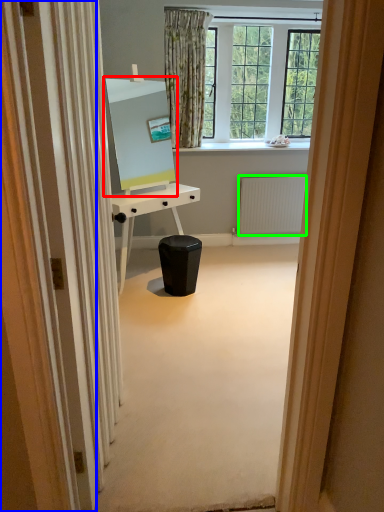
Question: Estimate the real-world distances between objects in this image. Which object is farther from computer monitor (highlighted by a red box), screen door (highlighted by a blue box) or radiator (highlighted by a green box)?

Choices:
 (A) screen door
 (B) radiator

Answer: (A)